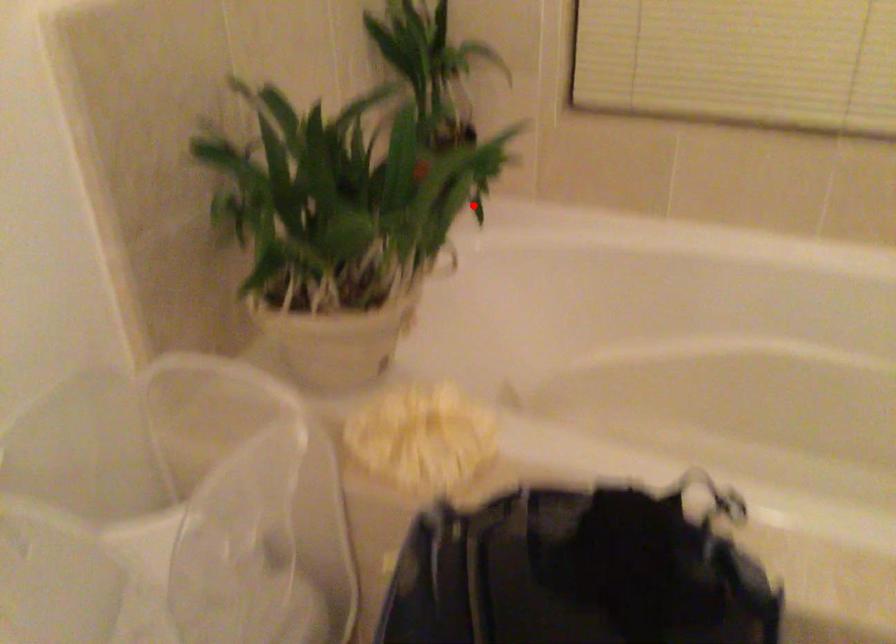
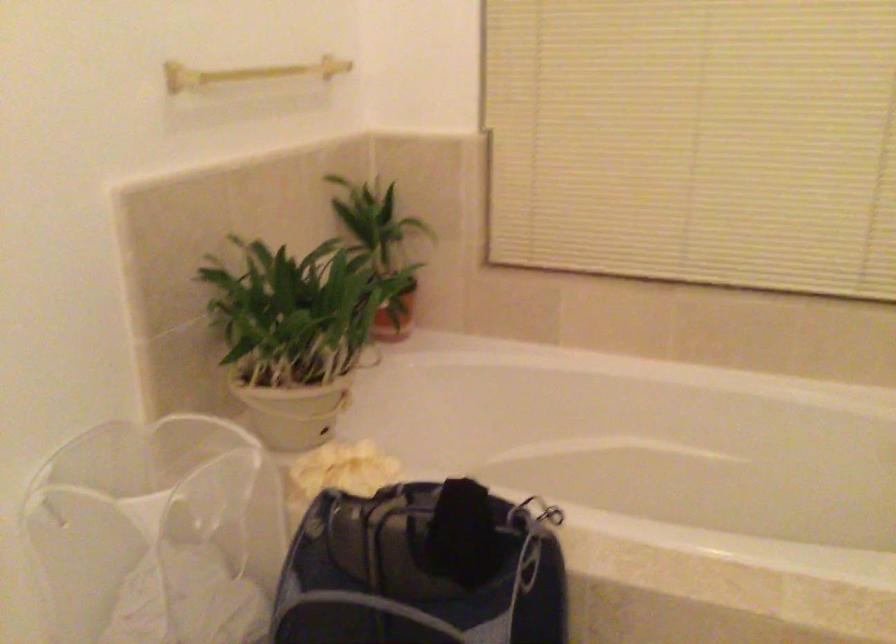
Locate, in the second image, the point that corresponds to the highlighted location in the first image.

(394, 317)